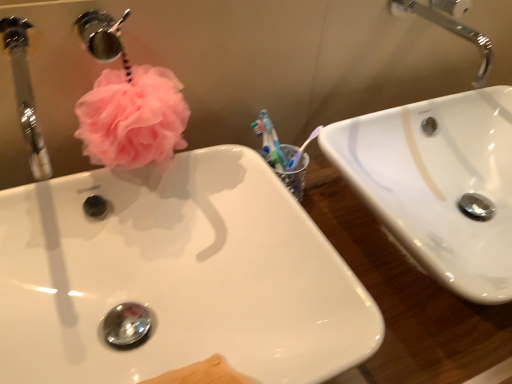
In the scene shown: In order to face brushed metal faucet at upper left, should I rotate leftwards or rightwards?

A 19.472 degree turn to the left will do.

What do you see at coordinates (452, 32) in the screenshot? This screenshot has height=384, width=512. I see `chrome metallic faucet at upper right` at bounding box center [452, 32].

This screenshot has width=512, height=384. In order to click on white glossy sink at upper right, which appears as the second sink when viewed from the left in this screenshot , I will do `click(438, 184)`.

Between point (179, 93) and point (93, 56), which one is positioned behind?

Positioned behind is point (93, 56).

How different are the orientations of pink fluffy loofah at upper left and brushed metal faucet at upper left in degrees?

0.00169 degrees separate the facing orientations of pink fluffy loofah at upper left and brushed metal faucet at upper left.

Measure the distance between pink fluffy loofah at upper left and brushed metal faucet at upper left.

pink fluffy loofah at upper left is 9.92 centimeters from brushed metal faucet at upper left.

Is pink fluffy loofah at upper left outside of brushed metal faucet at upper left?

That's correct, pink fluffy loofah at upper left is outside of brushed metal faucet at upper left.

At what (x,y) coordinates should I click in order to perform the action: click on sink that is the 2nd one below the brushed metal faucet at upper left (from a real-world perspective). Please return your answer as a coordinate pair (x, y). Image resolution: width=512 pixels, height=384 pixels. Looking at the image, I should click on (438, 184).

Is brushed metal faucet at upper left positioned far away from white glossy sink at upper right, the first sink in the right-to-left sequence?

brushed metal faucet at upper left is positioned a significant distance from white glossy sink at upper right, the first sink in the right-to-left sequence.

Looking at this image, is brushed metal faucet at upper left surrounding white glossy sink at upper right, which appears as the second sink when viewed from the left?

No, white glossy sink at upper right, which appears as the second sink when viewed from the left, is not surrounded by brushed metal faucet at upper left.

Is white glossy sink at center, which is the 2th sink from right to left, oriented away from pink fluffy loofah at upper left?

No, pink fluffy loofah at upper left is not at the back of white glossy sink at center, which is the 2th sink from right to left.

Considering the relative sizes of white glossy sink at center, which is the 2th sink from right to left, and pink fluffy loofah at upper left in the image provided, is white glossy sink at center, which is the 2th sink from right to left, bigger than pink fluffy loofah at upper left?

Indeed, white glossy sink at center, which is the 2th sink from right to left, has a larger size compared to pink fluffy loofah at upper left.

From the picture: Is pink fluffy loofah at upper left a part of white glossy sink at center, which is the 2th sink from right to left?

No, pink fluffy loofah at upper left is not a part of white glossy sink at center, which is the 2th sink from right to left.

From the image's perspective, would you say white glossy sink at center, the first sink from the left, is positioned over pink fluffy loofah at upper left?

Incorrect, from the image's perspective, white glossy sink at center, the first sink from the left, is lower than pink fluffy loofah at upper left.

Is point (486, 143) closer to viewer compared to point (26, 62)?

No, it is not.

Which of these two, white glossy sink at upper right, the first sink in the right-to-left sequence, or brushed metal faucet at upper left, stands shorter?

Standing shorter between the two is brushed metal faucet at upper left.

Is white glossy sink at upper right, which appears as the second sink when viewed from the left, oriented towards brushed metal faucet at upper left?

No, white glossy sink at upper right, which appears as the second sink when viewed from the left, is not facing towards brushed metal faucet at upper left.

Choose the correct answer: Is white glossy sink at upper right, which appears as the second sink when viewed from the left, inside brushed metal faucet at upper left or outside it?

white glossy sink at upper right, which appears as the second sink when viewed from the left, is not inside brushed metal faucet at upper left, it's outside.

Is white glossy sink at upper right, the first sink in the right-to-left sequence, shorter than chrome metallic faucet at upper right?

No.

This screenshot has height=384, width=512. I want to click on the 1st sink in front of the chrome metallic faucet at upper right, counting from the anchor's position, so click(x=438, y=184).

Is white glossy sink at upper right, which appears as the second sink when viewed from the left, inside or outside of chrome metallic faucet at upper right?

The correct answer is: outside.

In the scene shown: From the image's perspective, who appears lower, white glossy sink at upper right, the first sink in the right-to-left sequence, or chrome metallic faucet at upper right?

From the image's view, white glossy sink at upper right, the first sink in the right-to-left sequence, is below.

Is white glossy sink at center, the first sink from the left, next to brushed metal faucet at upper left and touching it?

No, white glossy sink at center, the first sink from the left, is not next to brushed metal faucet at upper left.

In order to click on sink that is the 1st object to the right of the brushed metal faucet at upper left, starting at the anchor in this screenshot , I will do `click(176, 276)`.

Is white glossy sink at center, which is the 2th sink from right to left, spatially inside brushed metal faucet at upper left, or outside of it?

The correct answer is: outside.

Considering the sizes of objects brushed metal faucet at upper left and pink fluffy loofah at upper left in the image provided, who is taller, brushed metal faucet at upper left or pink fluffy loofah at upper left?

pink fluffy loofah at upper left.

From the image's perspective, which is below, brushed metal faucet at upper left or pink fluffy loofah at upper left?

pink fluffy loofah at upper left appears lower in the image.

Identify the location of flower below the brushed metal faucet at upper left (from the image's perspective). The width and height of the screenshot is (512, 384). (132, 118).

Where is `flower behind the brushed metal faucet at upper left`? The width and height of the screenshot is (512, 384). flower behind the brushed metal faucet at upper left is located at coordinates (132, 118).

There is a white glossy sink at upper right, which appears as the second sink when viewed from the left. What are the coordinates of `plumbing fixture above it (from a real-world perspective)` in the screenshot? It's located at (103, 36).

From the image, which object appears to be nearer to brushed metal faucet at upper left, pink fluffy loofah at upper left or white glossy sink at upper right, the first sink in the right-to-left sequence?

pink fluffy loofah at upper left is closer to brushed metal faucet at upper left.

Based on their spatial positions, is chrome metallic faucet at upper right or brushed metal faucet at upper left further from brushed metal faucet at upper left?

chrome metallic faucet at upper right is positioned further to the anchor brushed metal faucet at upper left.

Which object lies nearer to the anchor point pink fluffy loofah at upper left, white glossy sink at center, which is the 2th sink from right to left, or brushed metal faucet at upper left?

Among the two, white glossy sink at center, which is the 2th sink from right to left, is located nearer to pink fluffy loofah at upper left.

Which object lies further to the anchor point chrome metallic faucet at upper right, brushed metal faucet at upper left or brushed metal faucet at upper left?

brushed metal faucet at upper left.

From the image, which object appears to be nearer to white glossy sink at upper right, which appears as the second sink when viewed from the left, white glossy sink at center, the first sink from the left, or brushed metal faucet at upper left?

white glossy sink at center, the first sink from the left, is closer to white glossy sink at upper right, which appears as the second sink when viewed from the left.

When comparing their distances from brushed metal faucet at upper left, does white glossy sink at center, the first sink from the left, or chrome metallic faucet at upper right seem further?

chrome metallic faucet at upper right is positioned further to the anchor brushed metal faucet at upper left.

Which object lies further to the anchor point brushed metal faucet at upper left, chrome metallic faucet at upper right or white glossy sink at center, the first sink from the left?

chrome metallic faucet at upper right.

Based on their spatial positions, is white glossy sink at center, the first sink from the left, or brushed metal faucet at upper left further from chrome metallic faucet at upper right?

brushed metal faucet at upper left is positioned further to the anchor chrome metallic faucet at upper right.

At what (x,y) coordinates should I click in order to perform the action: click on mirror between brushed metal faucet at upper left and white glossy sink at center, the first sink from the left, in the vertical direction. Please return your answer as a coordinate pair (x, y). Looking at the image, I should click on (25, 92).

This screenshot has width=512, height=384. Identify the location of flower between brushed metal faucet at upper left and white glossy sink at center, which is the 2th sink from right to left, vertically. (132, 118).

You are a GUI agent. You are given a task and a screenshot of the screen. Output one action in this format:
    pyautogui.click(x=<x>, y=<y>)
    Task: Click on the plumbing fixture between brushed metal faucet at upper left and chrome metallic faucet at upper right
    
    Given the screenshot: What is the action you would take?
    pyautogui.click(x=103, y=36)

Locate an element on the screen. The height and width of the screenshot is (384, 512). sink between brushed metal faucet at upper left and white glossy sink at upper right, which appears as the second sink when viewed from the left, from left to right is located at coordinates (176, 276).